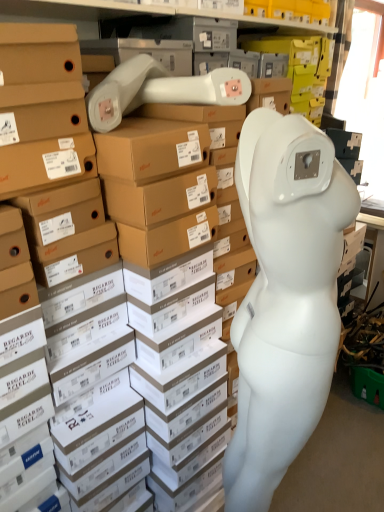
Question: Is white matte mannequin at right taller than white matte mannequin head at center?

Choices:
 (A) no
 (B) yes

Answer: (B)

Question: Could you tell me if white matte mannequin at right is facing white matte mannequin head at center?

Choices:
 (A) no
 (B) yes

Answer: (A)

Question: From a real-world perspective, is white matte mannequin at right under white matte mannequin head at center?

Choices:
 (A) no
 (B) yes

Answer: (B)

Question: From the image's perspective, is white matte mannequin at right located above white matte mannequin head at center?

Choices:
 (A) yes
 (B) no

Answer: (B)

Question: Is white matte mannequin at right outside of white matte mannequin head at center?

Choices:
 (A) no
 (B) yes

Answer: (B)

Question: Is white matte mannequin at right oriented away from white matte mannequin head at center?

Choices:
 (A) yes
 (B) no

Answer: (B)

Question: From a real-world perspective, is white matte mannequin head at center physically above white matte mannequin at right?

Choices:
 (A) yes
 (B) no

Answer: (A)

Question: Is white matte mannequin head at center to the left of white matte mannequin at right from the viewer's perspective?

Choices:
 (A) no
 (B) yes

Answer: (A)

Question: Could you tell me if white matte mannequin head at center is facing white matte mannequin at right?

Choices:
 (A) yes
 (B) no

Answer: (B)

Question: From the image's perspective, is white matte mannequin head at center beneath white matte mannequin at right?

Choices:
 (A) yes
 (B) no

Answer: (B)

Question: Can you confirm if white matte mannequin head at center is wider than white matte mannequin at right?

Choices:
 (A) no
 (B) yes

Answer: (B)

Question: Is the surface of white matte mannequin head at center in direct contact with white matte mannequin at right?

Choices:
 (A) no
 (B) yes

Answer: (A)

Question: Considering the positions of point (248, 164) and point (324, 257), is point (248, 164) closer or farther from the camera than point (324, 257)?

Choices:
 (A) farther
 (B) closer

Answer: (A)